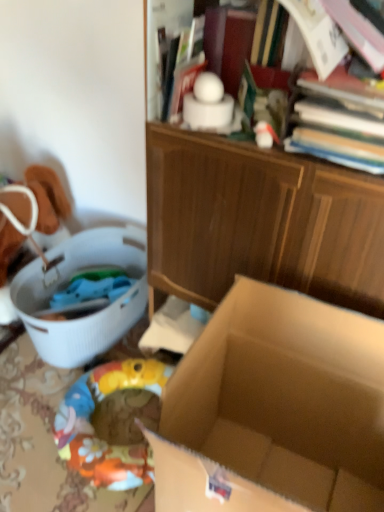
Question: Is hardcover book at upper right situated inside brown cardboard box at center or outside?

Choices:
 (A) outside
 (B) inside

Answer: (A)

Question: Considering the positions of hardcover book at upper right and brown cardboard box at center in the image, is hardcover book at upper right bigger or smaller than brown cardboard box at center?

Choices:
 (A) small
 (B) big

Answer: (A)

Question: Which of these objects is positioned farthest from the brown cardboard box at center?

Choices:
 (A) hardcover book at upper right
 (B) white plastic laundry basket at left

Answer: (B)

Question: Estimate the real-world distances between objects in this image. Which object is farther from the white plastic laundry basket at left?

Choices:
 (A) hardcover book at upper right
 (B) brown cardboard box at center

Answer: (A)